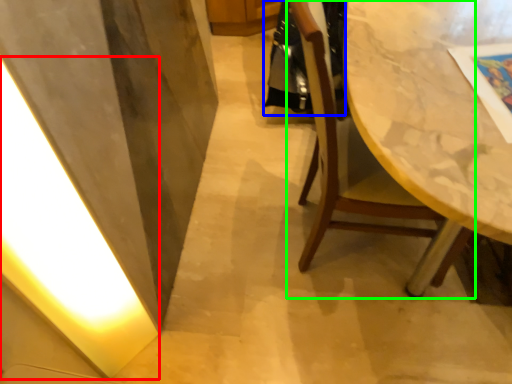
Question: Based on their relative distances, which object is nearer to light (highlighted by a red box)? Choose from robe (highlighted by a blue box) and chair (highlighted by a green box).

Choices:
 (A) robe
 (B) chair

Answer: (B)